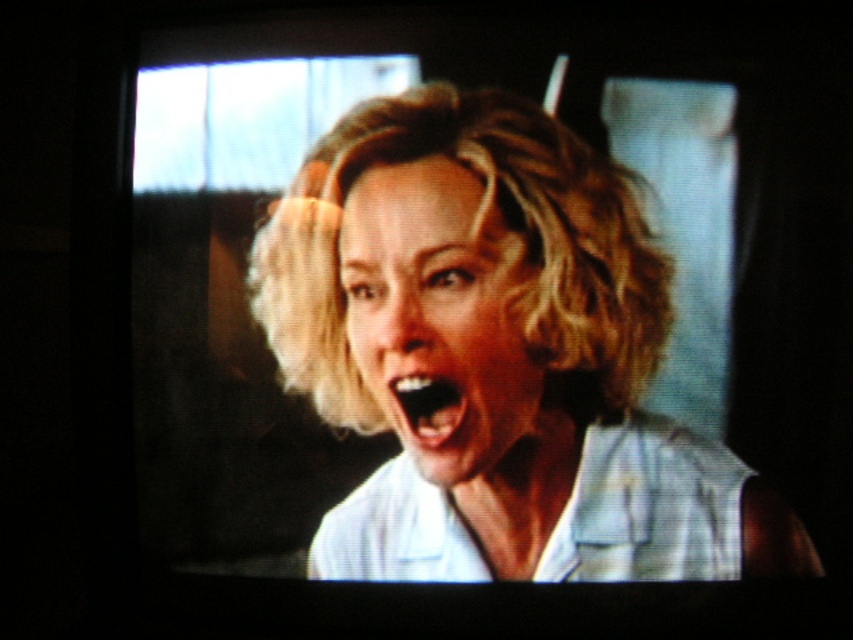
You are a costume designer preparing for a scene that requires knowing the arrangement of clothing relative to the actor. Given the image of the person with the white matte shirt at center and blonde hair at center, which item is located to the left of the other?

The blonde hair at center is to the left of the white matte shirt at center because the white matte shirt at center is positioned on the right side of blonde hair at center.

You are designing a costume for a theater play and need to ensure that the white matte shirt at center will cover the smooth white teeth at center completely. Based on the image, can the shirt potentially cover the teeth?

The white matte shirt at center might be wider than smooth white teeth at center, so there is a possibility that the shirt could cover the teeth if positioned correctly.

You are a costume designer working on a film scene. You need to ensure that the white matte shirt at center and the blonde hair at center are visible to the audience. Based on the scene description, which item is positioned in front of the other?

The white matte shirt at center is in front of the blonde hair at center, so the shirt will be more visible to the audience.